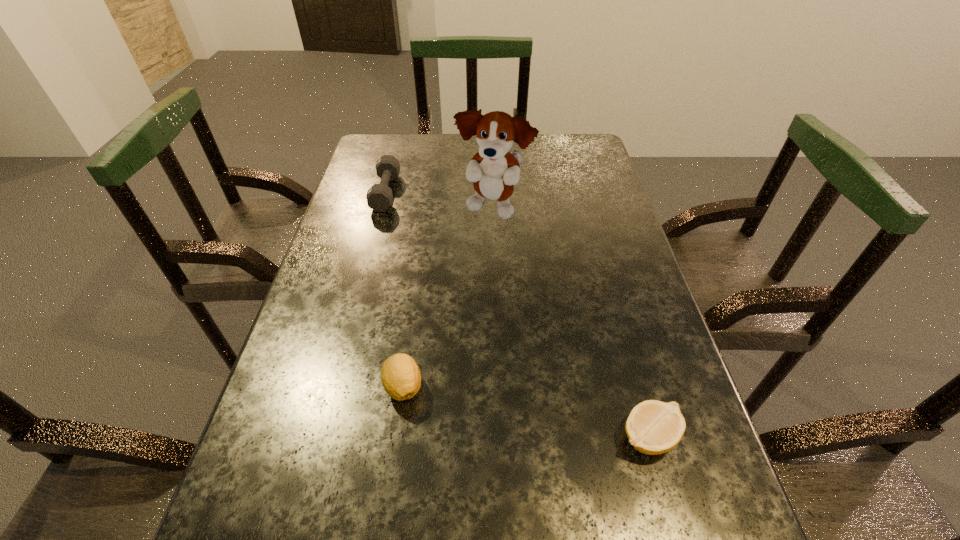
I want to click on vacant region between the left lemon and the dumbbell, so click(395, 289).

Where is `empty space between the left lemon and the tallest object`? The height and width of the screenshot is (540, 960). empty space between the left lemon and the tallest object is located at coordinates (448, 298).

The width and height of the screenshot is (960, 540). I want to click on vacant area between the right lemon and the left lemon, so click(526, 411).

Find the location of `vacant space that is in between the leftmost object and the second nearest object`. vacant space that is in between the leftmost object and the second nearest object is located at coordinates (395, 289).

Identify the location of vacant space that is in between the third farthest object and the dumbbell. (395, 289).

Identify the location of vacant point located between the taller lemon and the rightmost object. (526, 411).

Where is `empty location between the shorter lemon and the dumbbell`? The image size is (960, 540). empty location between the shorter lemon and the dumbbell is located at coordinates (516, 314).

You are a GUI agent. You are given a task and a screenshot of the screen. Output one action in this format:
    pyautogui.click(x=<x>, y=<y>)
    Task: Click on the free space between the dumbbell and the second nearest object
    The width and height of the screenshot is (960, 540).
    Given the screenshot: What is the action you would take?
    pyautogui.click(x=395, y=289)

This screenshot has height=540, width=960. I want to click on the third closest object to the third object from left to right, so click(653, 427).

Locate which object ranks third in proximity to the tallest object. Please provide its 2D coordinates. Your answer should be formatted as a tuple, i.e. [(x, y)], where the tuple contains the x and y coordinates of a point satisfying the conditions above.

[(653, 427)]